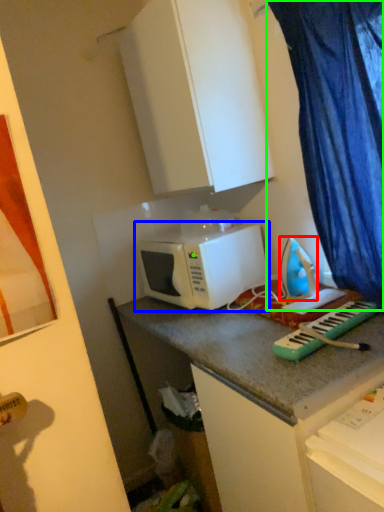
Question: Which is nearer to the appliance (highlighted by a red box)? microwave oven (highlighted by a blue box) or curtain (highlighted by a green box).

Choices:
 (A) microwave oven
 (B) curtain

Answer: (A)